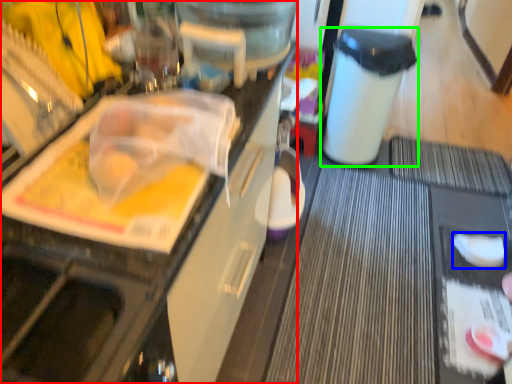
Question: Which object is positioned closest to cabinetry (highlighted by a red box)? Select from food (highlighted by a blue box) and trash bin/can (highlighted by a green box).

Choices:
 (A) food
 (B) trash bin/can

Answer: (B)